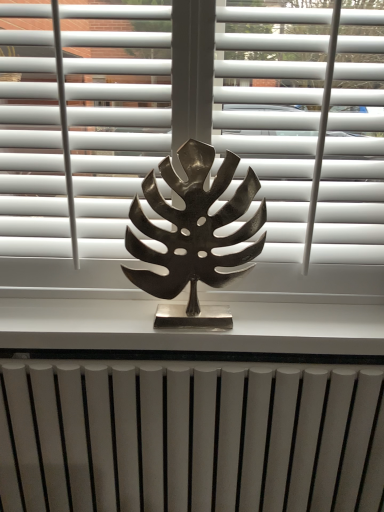
Where is `vacant space underneath bronze leaf at center (from a real-world perspective)`? The image size is (384, 512). vacant space underneath bronze leaf at center (from a real-world perspective) is located at coordinates (182, 326).